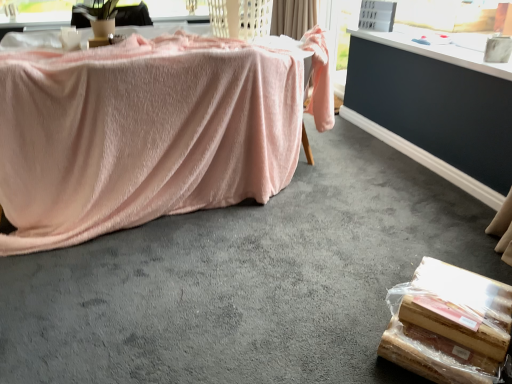
Question: Is the position of dark gray carpet at lower right more distant than that of beige fabric curtain at upper center?

Choices:
 (A) yes
 (B) no

Answer: (B)

Question: From the image's perspective, does dark gray carpet at lower right appear lower than beige fabric curtain at upper center?

Choices:
 (A) no
 (B) yes

Answer: (B)

Question: Does dark gray carpet at lower right touch beige fabric curtain at upper center?

Choices:
 (A) no
 (B) yes

Answer: (A)

Question: Is dark gray carpet at lower right smaller than beige fabric curtain at upper center?

Choices:
 (A) yes
 (B) no

Answer: (A)

Question: Is beige fabric curtain at upper center surrounded by dark gray carpet at lower right?

Choices:
 (A) no
 (B) yes

Answer: (A)

Question: From a real-world perspective, relative to beige fabric curtain at upper center, is pink fabric-covered object at left vertically above or below?

Choices:
 (A) below
 (B) above

Answer: (A)

Question: Is pink fabric-covered object at left inside or outside of beige fabric curtain at upper center?

Choices:
 (A) outside
 (B) inside

Answer: (A)

Question: Is pink fabric-covered object at left wider or thinner than beige fabric curtain at upper center?

Choices:
 (A) wide
 (B) thin

Answer: (A)

Question: In the image, is pink fabric-covered object at left positioned in front of or behind beige fabric curtain at upper center?

Choices:
 (A) front
 (B) behind

Answer: (A)

Question: Visually, is beige fabric curtain at upper center positioned to the left or to the right of dark gray carpet at lower right?

Choices:
 (A) left
 (B) right

Answer: (A)

Question: In the image, is beige fabric curtain at upper center positioned in front of or behind dark gray carpet at lower right?

Choices:
 (A) behind
 (B) front

Answer: (A)

Question: Based on their sizes in the image, would you say beige fabric curtain at upper center is bigger or smaller than dark gray carpet at lower right?

Choices:
 (A) big
 (B) small

Answer: (A)

Question: Is beige fabric curtain at upper center inside or outside of dark gray carpet at lower right?

Choices:
 (A) outside
 (B) inside

Answer: (A)

Question: From the image's perspective, relative to wooden board at lower right, is pink fabric-covered object at left above or below?

Choices:
 (A) below
 (B) above

Answer: (B)

Question: Considering the positions of point (476, 213) and point (463, 299), is point (476, 213) closer or farther from the camera than point (463, 299)?

Choices:
 (A) farther
 (B) closer

Answer: (A)